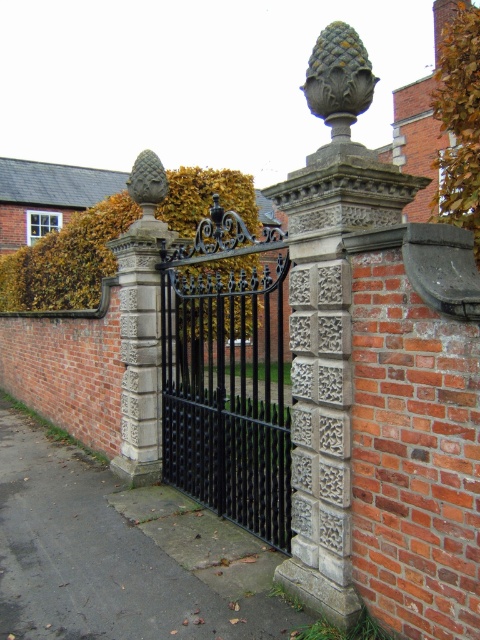
Does black wrought iron gate at center come in front of stone textured acorn at center?

No, black wrought iron gate at center is further to the viewer.

Is point (222, 276) positioned after point (357, 68)?

Yes, it is behind point (357, 68).

Is point (251, 474) in front of point (313, 81)?

That is False.

Image resolution: width=480 pixels, height=640 pixels. I want to click on black wrought iron gate at center, so click(x=228, y=374).

Does point (311, 99) lie in front of point (153, 180)?

Yes, point (311, 99) is closer to viewer.

Describe the element at coordinates (338, 77) in the screenshot. I see `stone textured acorn at center` at that location.

You are a GUI agent. You are given a task and a screenshot of the screen. Output one action in this format:
    pyautogui.click(x=<x>, y=<y>)
    Task: Click on the stone textured acorn at center
    Image resolution: width=480 pixels, height=640 pixels.
    Given the screenshot: What is the action you would take?
    pyautogui.click(x=338, y=77)

This screenshot has height=640, width=480. Identify the location of black wrought iron gate at center. (228, 374).

Does black wrought iron gate at center have a smaller size compared to matte gray acorn at center?

Actually, black wrought iron gate at center might be larger than matte gray acorn at center.

You are a GUI agent. You are given a task and a screenshot of the screen. Output one action in this format:
    pyautogui.click(x=<x>, y=<y>)
    Task: Click on the black wrought iron gate at center
    Image resolution: width=480 pixels, height=640 pixels.
    Given the screenshot: What is the action you would take?
    pyautogui.click(x=228, y=374)

Find the location of `black wrought iron gate at center`. black wrought iron gate at center is located at coordinates (228, 374).